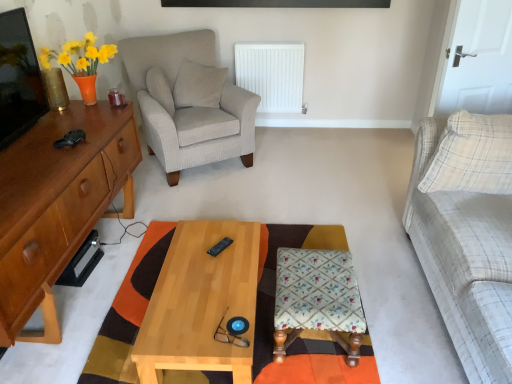
Question: From the image's perspective, is floral fabric stool at center located beneath light wood/texture coffee table at center?

Choices:
 (A) no
 (B) yes

Answer: (B)

Question: Could light wood/texture coffee table at center be considered to be inside floral fabric stool at center?

Choices:
 (A) no
 (B) yes

Answer: (A)

Question: Is floral fabric stool at center shorter than light wood/texture coffee table at center?

Choices:
 (A) yes
 (B) no

Answer: (B)

Question: Considering the relative sizes of floral fabric stool at center and light wood/texture coffee table at center in the image provided, is floral fabric stool at center taller than light wood/texture coffee table at center?

Choices:
 (A) no
 (B) yes

Answer: (B)

Question: Does floral fabric stool at center have a lesser width compared to light wood/texture coffee table at center?

Choices:
 (A) no
 (B) yes

Answer: (B)

Question: Could you tell me if floral fabric stool at center is facing light wood/texture coffee table at center?

Choices:
 (A) no
 (B) yes

Answer: (B)

Question: Is white plaid pillow at right, which is the 3th pillow from left to right, turned away from floral fabric stool at center?

Choices:
 (A) no
 (B) yes

Answer: (A)

Question: From a real-world perspective, is white plaid pillow at right, the first pillow in the right-to-left sequence, beneath floral fabric stool at center?

Choices:
 (A) yes
 (B) no

Answer: (B)

Question: From the image's perspective, is white plaid pillow at right, marked as the 3th pillow in a back-to-front arrangement, below floral fabric stool at center?

Choices:
 (A) no
 (B) yes

Answer: (A)

Question: Does white plaid pillow at right, marked as the 3th pillow in a back-to-front arrangement, have a greater width compared to floral fabric stool at center?

Choices:
 (A) yes
 (B) no

Answer: (B)

Question: Is white plaid pillow at right, the first pillow in the right-to-left sequence, thinner than floral fabric stool at center?

Choices:
 (A) yes
 (B) no

Answer: (A)

Question: From a real-world perspective, is white plaid pillow at right, which is the 3th pillow from left to right, located higher than floral fabric stool at center?

Choices:
 (A) yes
 (B) no

Answer: (A)

Question: Can you confirm if light wood/texture coffee table at center is positioned to the right of white plastic radiator at center?

Choices:
 (A) no
 (B) yes

Answer: (A)